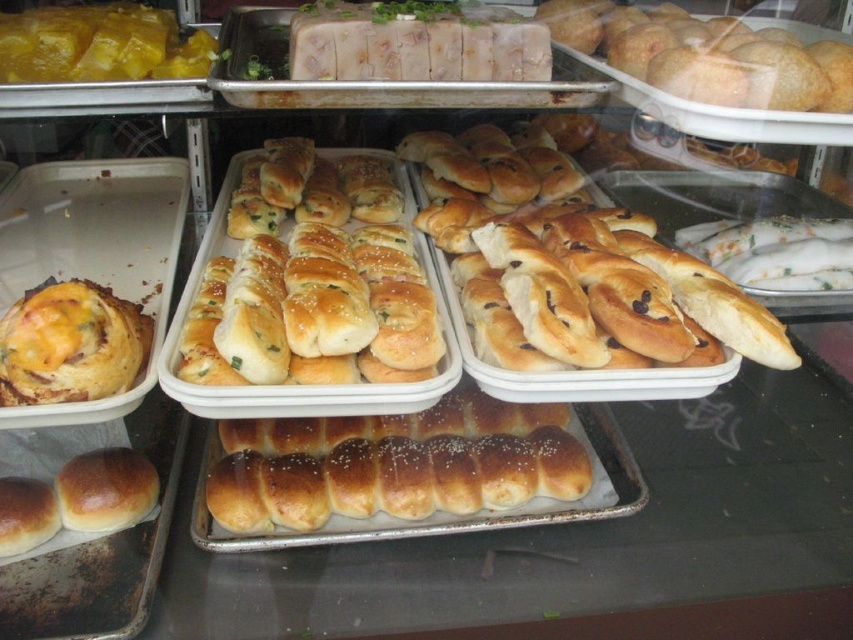
Question: Observing the image, what is the correct spatial positioning of golden brown doughnut at center in reference to yellow matte cheese at upper left?

Choices:
 (A) right
 (B) left

Answer: (A)

Question: Does yellow cheesy bread at left appear on the right side of yellow matte cheese at upper left?

Choices:
 (A) yes
 (B) no

Answer: (A)

Question: Which is nearer to the yellow matte cheese at upper left?

Choices:
 (A) golden brown crusty rolls at center
 (B) golden brown crusty bagel at center
 (C) yellow cheesy bread at left
 (D) golden brown doughnut at center

Answer: (A)

Question: Which of the following is the closest to the observer?

Choices:
 (A) golden brown crusty bagel at center
 (B) golden brown crusty rolls at center
 (C) golden brown doughnut at center

Answer: (A)

Question: Which object is positioned closest to the yellow cheesy bread at left?

Choices:
 (A) yellow matte cheese at upper left
 (B) golden brown doughnut at center

Answer: (A)

Question: Is yellow cheesy bread at left above yellow matte cheese at upper left?

Choices:
 (A) yes
 (B) no

Answer: (B)